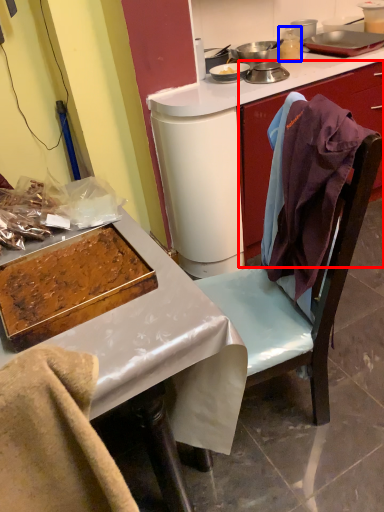
Question: Which object is closer to the camera taking this photo, cabinetry (highlighted by a red box) or appliance (highlighted by a blue box)?

Choices:
 (A) cabinetry
 (B) appliance

Answer: (A)